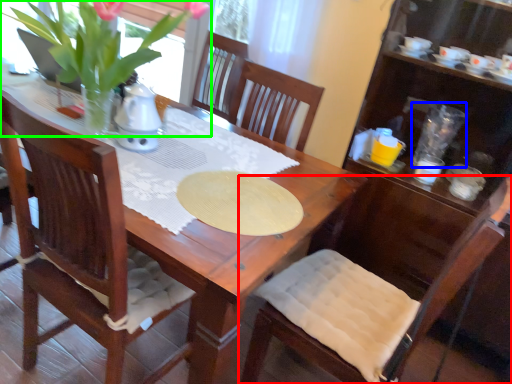
Question: Considering the real-world distances, which object is farthest from chair (highlighted by a red box)? tableware (highlighted by a blue box) or houseplant (highlighted by a green box)?

Choices:
 (A) tableware
 (B) houseplant

Answer: (B)